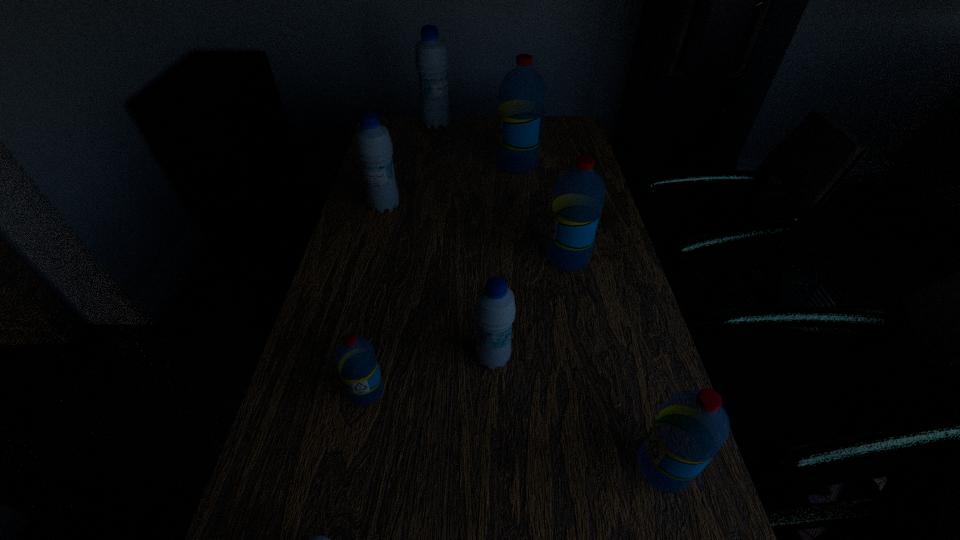
Where is `the nearest red water bottle`? the nearest red water bottle is located at coordinates (692, 426).

Where is `the third biggest red water bottle`? The height and width of the screenshot is (540, 960). the third biggest red water bottle is located at coordinates coord(692,426).

Identify the location of the leftmost red water bottle. [x=355, y=357].

This screenshot has width=960, height=540. Identify the location of the third nearest object. (355, 357).

You are a GUI agent. You are given a task and a screenshot of the screen. Output one action in this format:
    pyautogui.click(x=<x>, y=<y>)
    Task: Click on the free location located on the right of the farthest blue water bottle
    
    Given the screenshot: What is the action you would take?
    pyautogui.click(x=550, y=125)

The height and width of the screenshot is (540, 960). I want to click on free spot located 0.280m on the front label of the farthest red water bottle, so pyautogui.click(x=417, y=165).

Find the location of `free location located 0.350m on the front label of the farthest red water bottle`. free location located 0.350m on the front label of the farthest red water bottle is located at coordinates (396, 165).

In order to click on free point located on the front label of the farthest red water bottle in this screenshot , I will do `click(453, 165)`.

Locate an element on the screen. This screenshot has height=540, width=960. free spot located 0.120m on the right of the second biggest blue water bottle is located at coordinates (440, 207).

This screenshot has width=960, height=540. Identify the location of vacant region located 0.280m on the front label of the third nearest red water bottle. (443, 258).